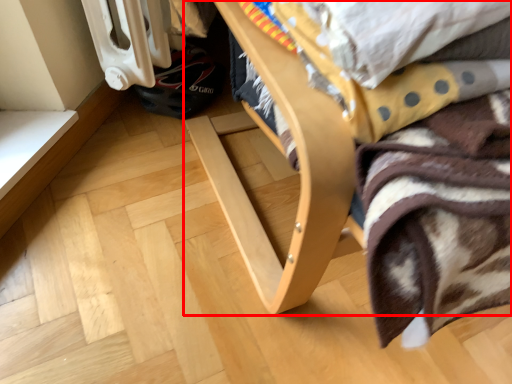
Question: Observing the image, what is the correct spatial positioning of furniture (annotated by the red box) in reference to blanket?

Choices:
 (A) left
 (B) right

Answer: (B)